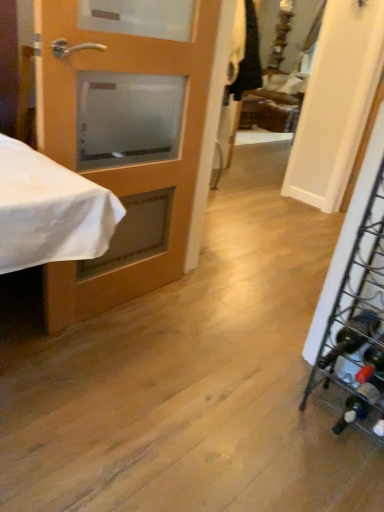
I want to click on free region under matte wood door at left (from a real-world perspective), so click(x=129, y=303).